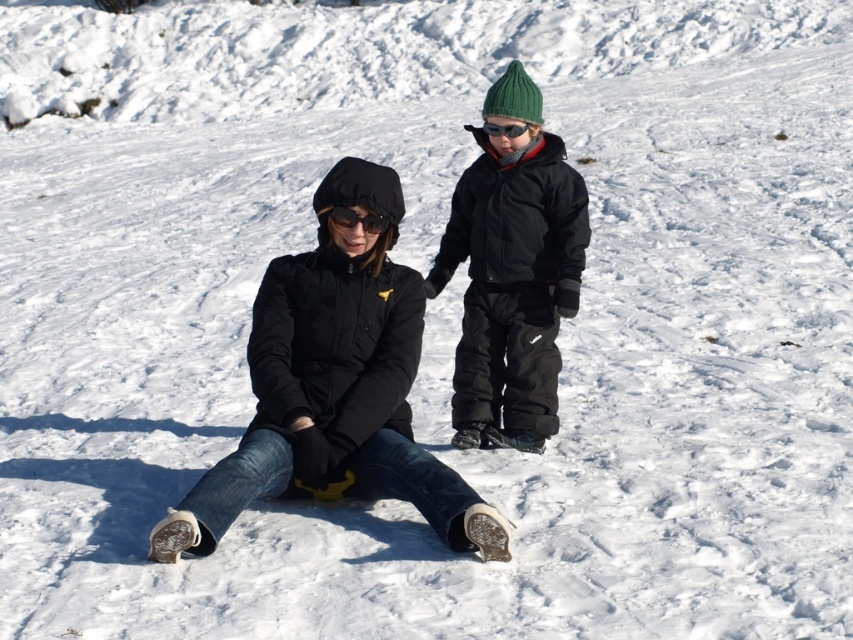
You are using a drone to take a photo of the scene described. The drone has a camera with a rectangular frame that can only capture objects within a specific coordinate range. The camera frame is set to capture from coordinates x between 0.5 and 0.6 and y between 0.4 and 0.5. Will the black matte jacket at center be fully inside the camera frame?

The position of black matte jacket at center is at point [404,340]. Since the camera frame is set to capture x between 0.5 and 0.6 and y between 0.4 and 0.5, the coordinates 0.533 fall within the x range and 0.475 falls within the y range. Therefore, the black matte jacket at center will be fully inside the camera frame.

You are a photographer trying to capture a photo of the two people in the snowy scene. You want to ensure that both the point at (335, 211) and the point at (521, 131) are in focus. Given that your camera can only focus on one point at a time, which point should you choose to maximize the chances of both being in focus?

You should focus on point (521, 131) because it is farther from the camera than point (335, 211). Focusing on the farther point will result in a deeper depth of field, making both points more likely to be in focus.

You are a photographer trying to capture a clear shot of both the matte black goggles at center and the black matte goggles at upper center. Which pair of goggles will appear larger in your photo?

The matte black goggles at center will appear larger in the photo because they are closer to the viewer than the black matte goggles at upper center.